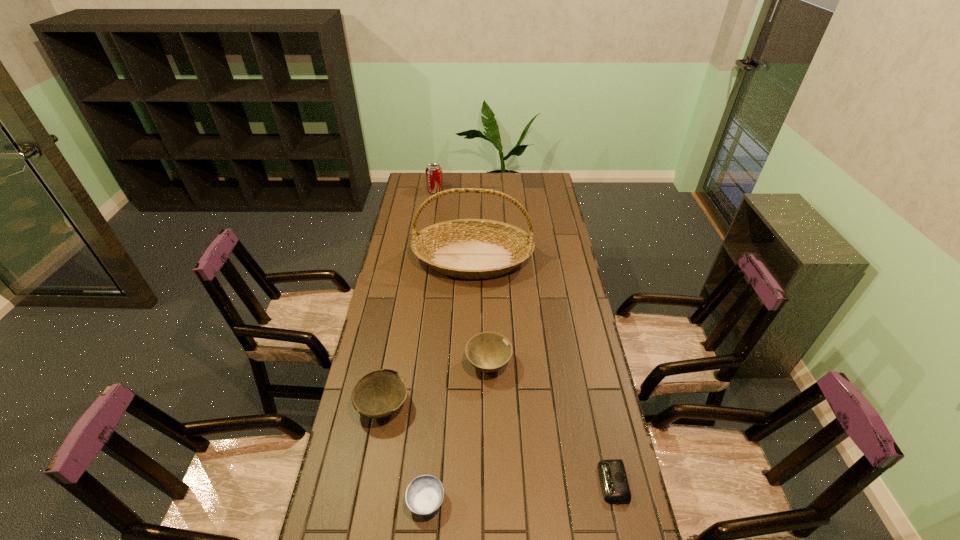
The image size is (960, 540). Identify the location of free point between the rightmost object and the ashtray. (519, 492).

Find the location of a particular element. This screenshot has width=960, height=540. empty space between the alarm clock and the left bowl is located at coordinates (498, 444).

The image size is (960, 540). I want to click on vacant area that lies between the rightmost object and the left bowl, so click(498, 444).

Locate an element on the screen. vacant region between the fifth nearest object and the ashtray is located at coordinates (449, 380).

At what (x,y) coordinates should I click in order to perform the action: click on empty space that is in between the left bowl and the fifth tallest object. Please return your answer as a coordinate pair (x, y). The width and height of the screenshot is (960, 540). Looking at the image, I should click on (405, 454).

Where is `vacant point located between the right bowl and the left bowl`? This screenshot has height=540, width=960. vacant point located between the right bowl and the left bowl is located at coordinates (436, 385).

Find the location of a particular element. This screenshot has height=540, width=960. object that is the closest one to the shortest object is located at coordinates (488, 351).

Select which object appears as the second closest to the rightmost object. Please provide its 2D coordinates. Your answer should be formatted as a tuple, i.e. [(x, y)], where the tuple contains the x and y coordinates of a point satisfying the conditions above.

[(424, 495)]

I want to click on vacant area that satisfies the following two spatial constraints: 1. on the front side of the ashtray; 2. on the right side of the soda can, so click(391, 501).